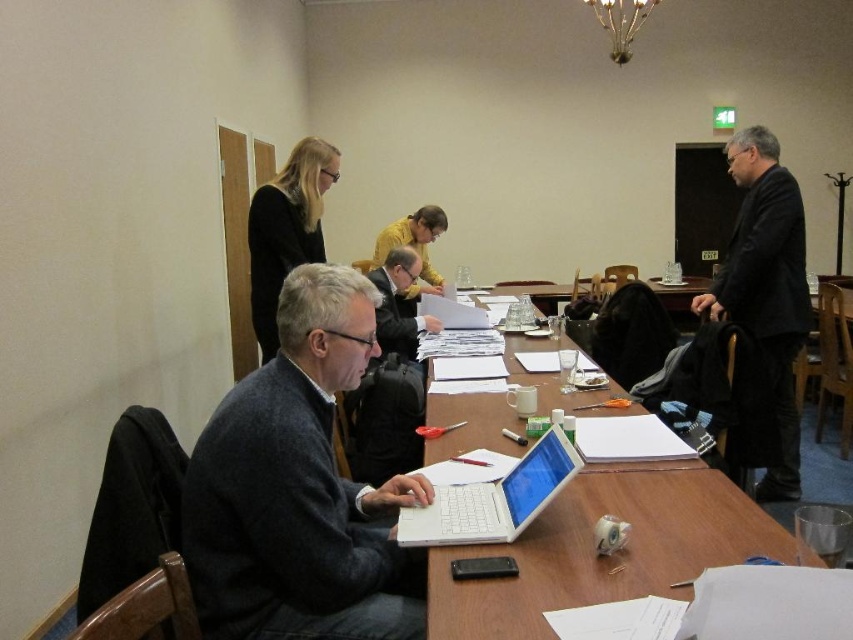
What are the coordinates of the dark gray sweater at center?

The dark gray sweater at center is located at point (399, 305).

You are organizing a workshop and need to place a name tag on the table. The name tag is the same width as the dark gray sweater at center. Will the white plastic laptop at center fit on the table without overlapping the name tag?

The white plastic laptop at center is wider than the dark gray sweater at center. Since the name tag has the same width as the dark gray sweater at center, the laptop will fit on the table without overlapping the name tag as it is wider and can be positioned accordingly.